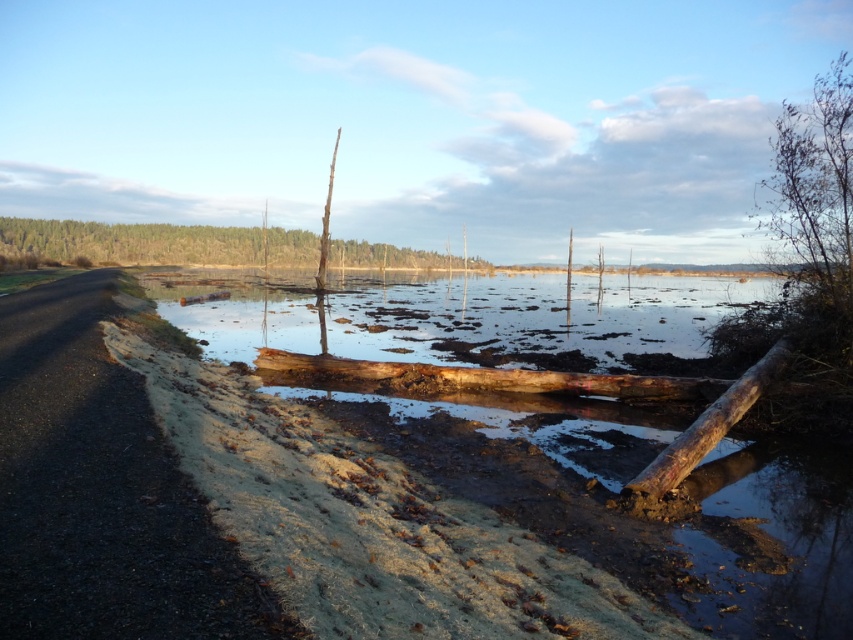
You are a bird flying over the landscape and want to land on the tallest object between the brown wood tree at upper center and the brown rough wood log at lower right. Which object should you choose?

The brown wood tree at upper center is taller than the brown rough wood log at lower right, so you should land on the brown wood tree at upper center.

You are a bird looking for a place to perch. You see the bare branches at upper right and the brown wood tree at upper center. Which one is higher up in the sky?

The bare branches at upper right is above the brown wood tree at upper center, so it is higher up in the sky.

You are a drone operator trying to capture a closeup of the brown wood log at center. The drone has a GPS coordinate system where the bottom left corner is the origin point. The log is at coordinate point 0.755, 0.735. If you want to move the drone to the right by 0.05 units, what will be the new coordinate of the log?

The new coordinate will be (625, 515) because moving to the right increases the x coordinate by 0.05 units.